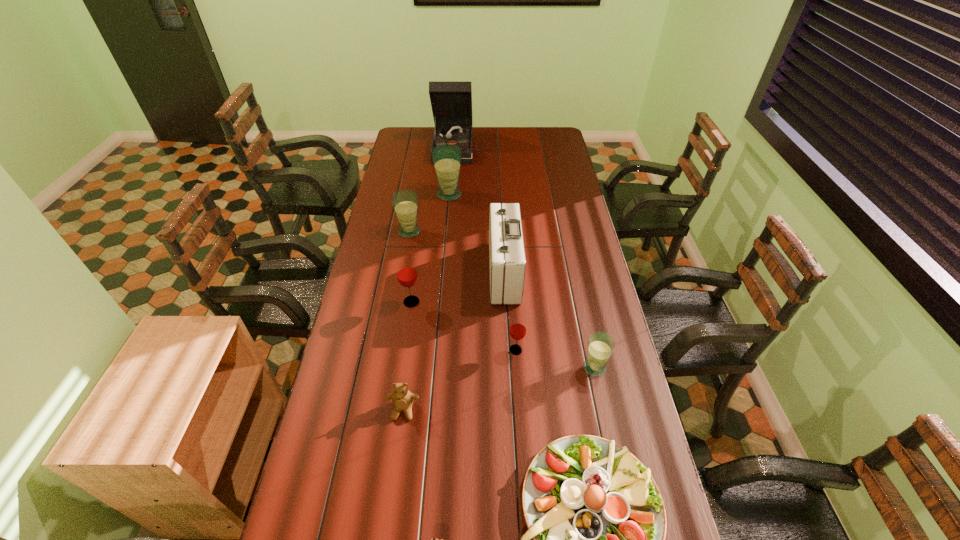
Identify the location of phonograph_record. (451, 102).

You are a GUI agent. You are given a task and a screenshot of the screen. Output one action in this format:
    pyautogui.click(x=<x>, y=<y>)
    Task: Click on the farthest object
    
    Given the screenshot: What is the action you would take?
    coord(451,102)

Locate an element on the screen. The height and width of the screenshot is (540, 960). the farthest blue glass is located at coordinates (446, 158).

Identify the location of the third glass from left to right. coord(446,158).

Where is `red first-aid kit`? red first-aid kit is located at coordinates (507, 262).

At what (x,y) coordinates should I click in order to perform the action: click on the third farthest glass. Please return your answer as a coordinate pair (x, y). This screenshot has width=960, height=540. Looking at the image, I should click on (407, 276).

You are a GUI agent. You are given a task and a screenshot of the screen. Output one action in this format:
    pyautogui.click(x=<x>, y=<y>)
    Task: Click on the bigger red glass
    The height and width of the screenshot is (540, 960).
    Given the screenshot: What is the action you would take?
    pyautogui.click(x=407, y=276)

Image resolution: width=960 pixels, height=540 pixels. In order to click on the leftmost blue glass in this screenshot , I will do `click(405, 201)`.

Where is `the fourth nearest glass`? The height and width of the screenshot is (540, 960). the fourth nearest glass is located at coordinates (405, 201).

Find the location of `the rightmost glass`. the rightmost glass is located at coordinates (601, 345).